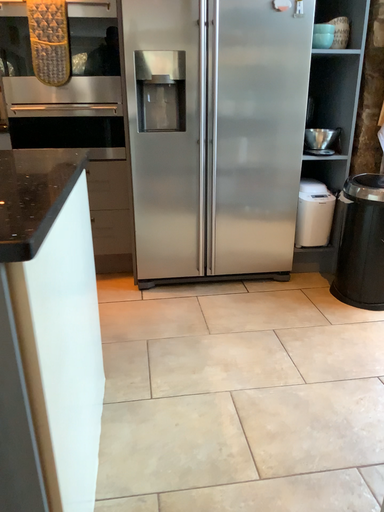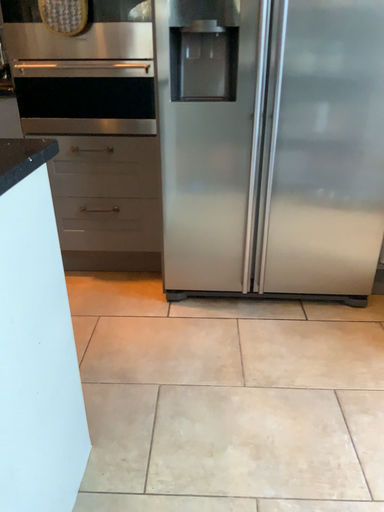
Question: How did the camera likely rotate when shooting the video?

Choices:
 (A) rotated right
 (B) rotated left

Answer: (B)